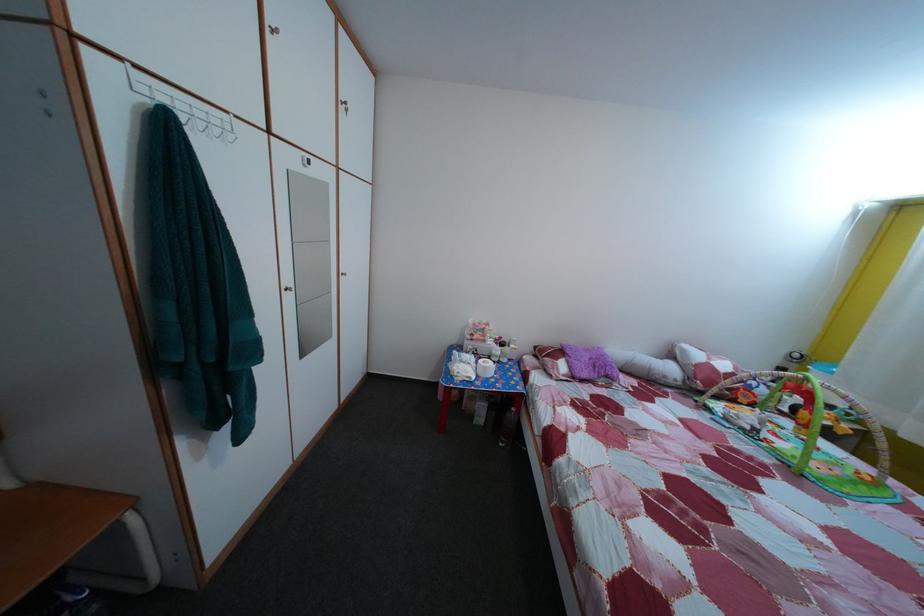
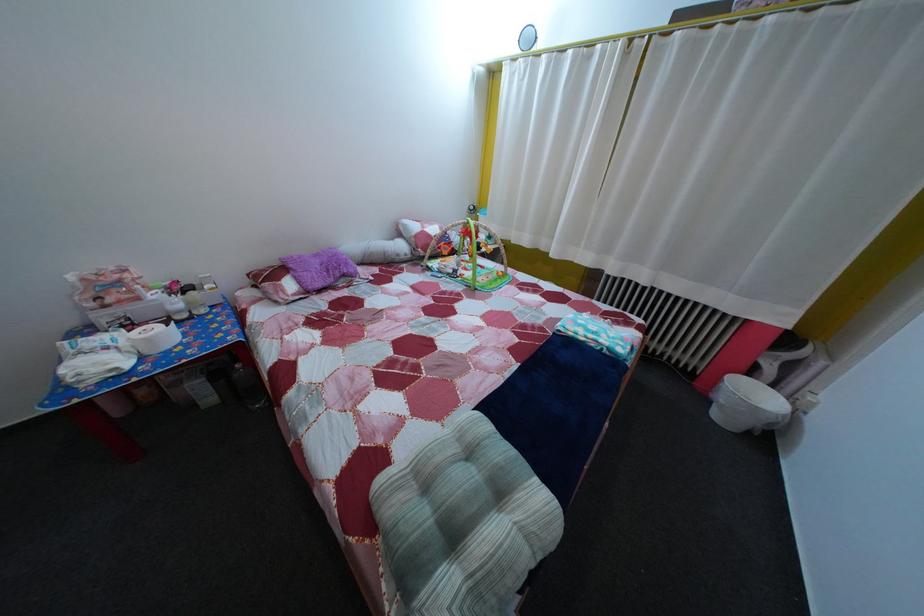
The images are taken continuously from a first-person perspective. In which direction is your viewpoint rotating?

The camera rotated toward right-down.